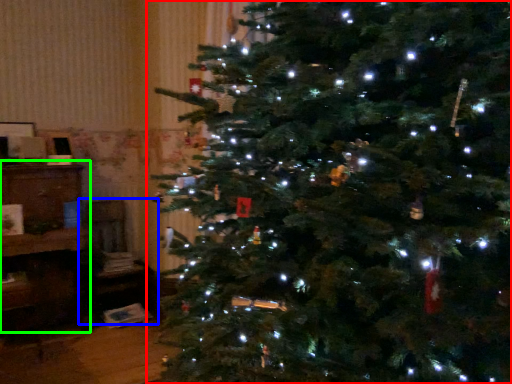
Question: Estimate the real-world distances between objects in this image. Which object is closer to christmas tree (highlighted by a red box), chair (highlighted by a blue box) or furniture (highlighted by a green box)?

Choices:
 (A) chair
 (B) furniture

Answer: (B)